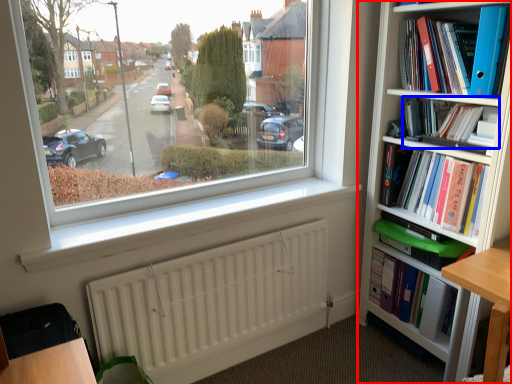
Question: Among these objects, which one is farthest to the camera, bookcase (highlighted by a red box) or book (highlighted by a blue box)?

Choices:
 (A) bookcase
 (B) book

Answer: (B)